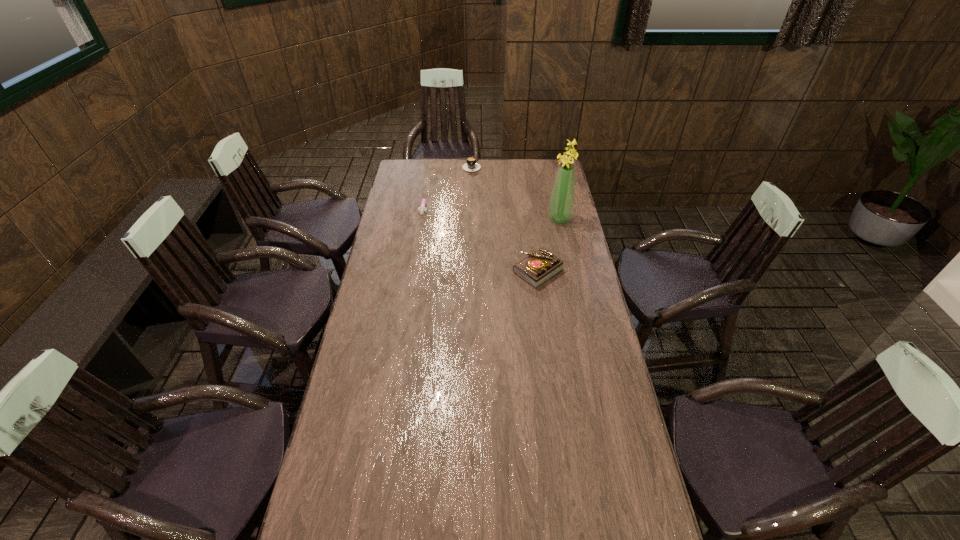
The image size is (960, 540). In order to click on free space between the third object from right to left and the bouquet in this screenshot , I will do `click(516, 192)`.

Find the location of a particular element. free area in between the third object from right to left and the leftmost object is located at coordinates (447, 185).

Where is `vacant area that lies between the diary and the bouquet`? Image resolution: width=960 pixels, height=540 pixels. vacant area that lies between the diary and the bouquet is located at coordinates (548, 245).

Identify the location of object that ranks as the second closest to the diary. This screenshot has height=540, width=960. (422, 209).

The height and width of the screenshot is (540, 960). Identify the location of object that is the nearest to the leftmost object. (471, 165).

The image size is (960, 540). I want to click on free space that satisfies the following two spatial constraints: 1. on the back side of the bouquet; 2. on the left side of the diary, so click(x=531, y=219).

Image resolution: width=960 pixels, height=540 pixels. I want to click on vacant space that satisfies the following two spatial constraints: 1. on the back side of the bouquet; 2. on the right side of the nearest object, so pos(531,219).

At what (x,y) coordinates should I click in order to perform the action: click on free space that satisfies the following two spatial constraints: 1. on the front side of the diary; 2. on the left side of the shortest object. Please return your answer as a coordinate pair (x, y). Looking at the image, I should click on (413, 271).

The image size is (960, 540). Find the location of `free space in the image that satisfies the following two spatial constraints: 1. on the back side of the third object from right to left; 2. on the left side of the shortest object`. free space in the image that satisfies the following two spatial constraints: 1. on the back side of the third object from right to left; 2. on the left side of the shortest object is located at coordinates (430, 166).